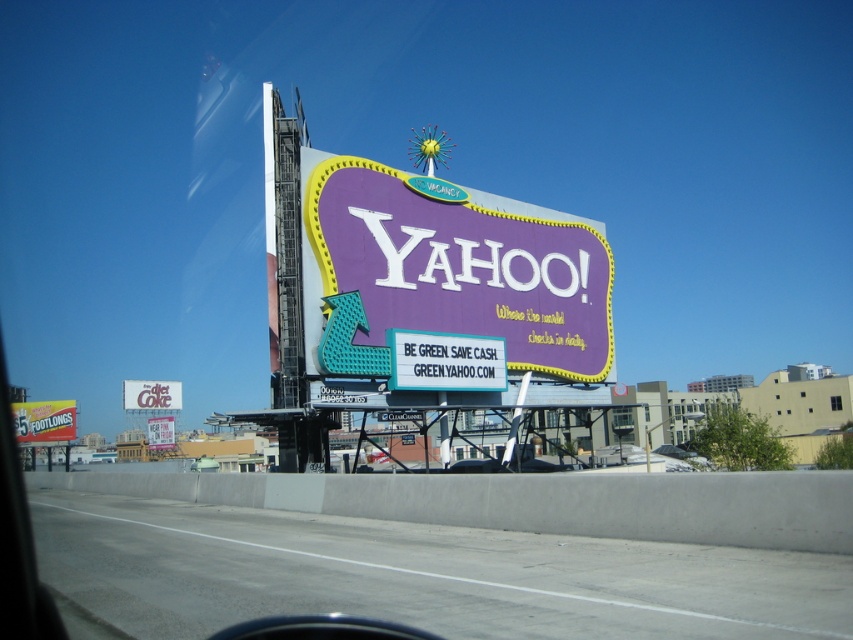
You are a GPS navigation system guiding a driver approaching the highway. The driver wants to locate the purple glossy billboard at center. What coordinates should you provide to the driver?

The purple glossy billboard at center is located at coordinates point (462, 266).

You are standing in front of the Yahoo! billboard. There is a specific point marked at coordinates point (693,620). If you want to touch this point with a 6.2 meter long stick, will you be able to reach it?

The point (693,620) is 6.29 meters from viewer. Since the stick is 6.2 meters long, which is slightly shorter than the distance to the point, you won measurements and the point is 6.29 meters away, the stick is not long enough to reach it.

You are a driver approaching the highway and see the purple glossy billboard at center and the white plastic signboard at center. Which one appears closer to you as you drive towards them?

The purple glossy billboard at center is in front of the white plastic signboard at center, so it appears closer to you as you drive towards them.